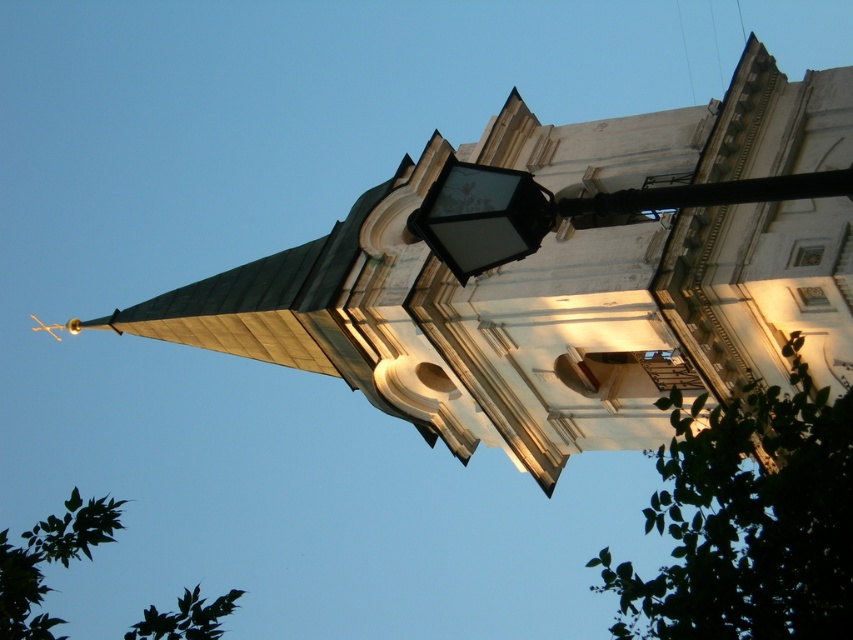
Question: Which point is closer to the camera taking this photo?

Choices:
 (A) (4, 605)
 (B) (791, 369)
 (C) (712, 124)

Answer: (A)

Question: Which point is farther to the camera?

Choices:
 (A) green stone church steeple at upper center
 (B) black glass lamp post at upper center
 (C) green leafy tree at lower right

Answer: (C)

Question: Which of the following is the farthest from the observer?

Choices:
 (A) (479, 170)
 (B) (1, 584)
 (C) (627, 156)
 (D) (821, 516)

Answer: (C)

Question: Is green stone church steeple at upper center below green leafy tree at lower right?

Choices:
 (A) no
 (B) yes

Answer: (A)

Question: Is black glass lamp post at upper center to the left of green leafy tree at lower left from the viewer's perspective?

Choices:
 (A) yes
 (B) no

Answer: (B)

Question: Does green stone church steeple at upper center appear on the right side of black glass lamp post at upper center?

Choices:
 (A) no
 (B) yes

Answer: (A)